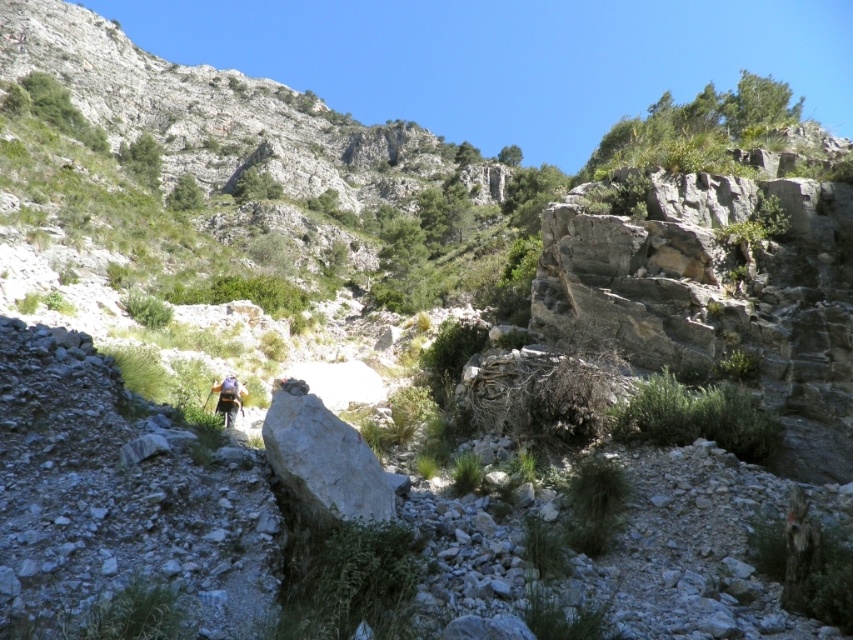
Between white smooth rock at center and light blue fabric backpack at center, which one appears on the left side from the viewer's perspective?

From the viewer's perspective, light blue fabric backpack at center appears more on the left side.

Can you confirm if white smooth rock at center is bigger than light blue fabric backpack at center?

Yes.

What do you see at coordinates (323, 461) in the screenshot?
I see `white smooth rock at center` at bounding box center [323, 461].

I want to click on white smooth rock at center, so click(323, 461).